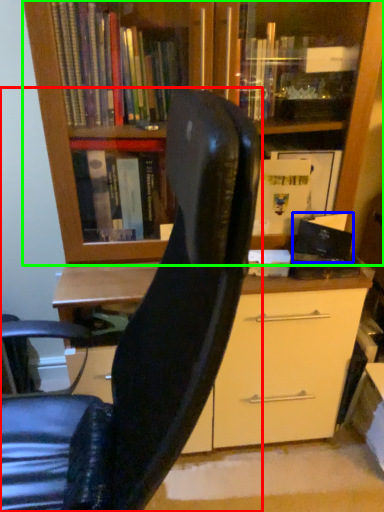
Question: Based on their relative distances, which object is nearer to chair (highlighted by a red box)? Choose from paperback book (highlighted by a blue box) and bookcase (highlighted by a green box).

Choices:
 (A) paperback book
 (B) bookcase

Answer: (B)